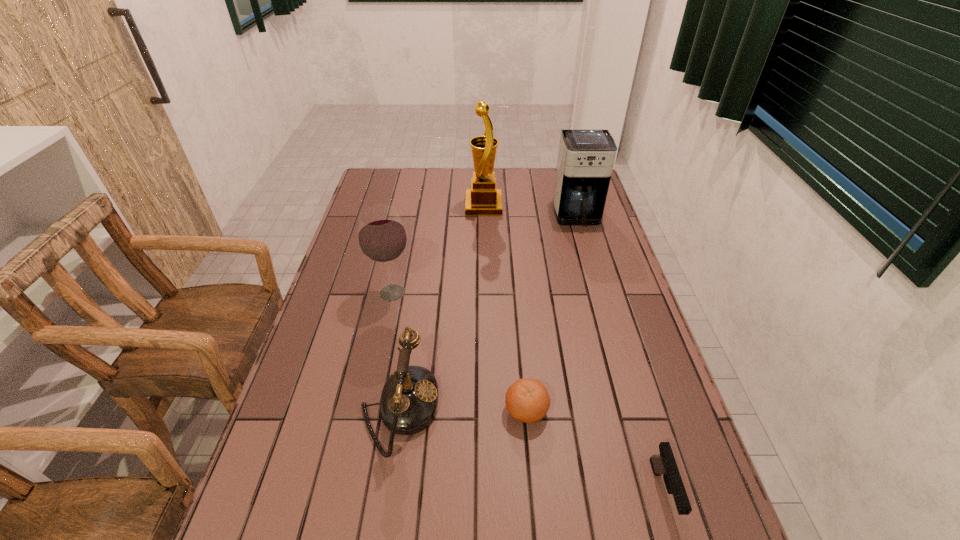
I want to click on vacant space at the far left corner of the desktop, so click(387, 177).

Identify the location of vacant space that's between the pistol and the coffee maker. (620, 354).

Find the location of a particular element. This screenshot has width=960, height=540. free space that is in between the third shortest object and the coffee maker is located at coordinates (489, 313).

You are a GUI agent. You are given a task and a screenshot of the screen. Output one action in this format:
    pyautogui.click(x=<x>, y=<y>)
    Task: Click on the free point between the telephone and the pistol
    The image size is (960, 540).
    Given the screenshot: What is the action you would take?
    pyautogui.click(x=531, y=450)

Find the location of a particular element. This screenshot has width=960, height=540. free space between the clementine and the fourth tallest object is located at coordinates coord(463,409).

Identify the location of free spot between the clementine and the alcohol. (460, 351).

Where is `vacant space in between the third shortest object and the tallest object`? Image resolution: width=960 pixels, height=540 pixels. vacant space in between the third shortest object and the tallest object is located at coordinates (442, 307).

Image resolution: width=960 pixels, height=540 pixels. I want to click on free area in between the fourth tallest object and the award, so click(x=442, y=307).

Identify the location of unoccupied position between the third farthest object and the third shortest object. The image size is (960, 540). (396, 351).

The image size is (960, 540). Find the location of `object that is the fourth closest to the tallest object`. object that is the fourth closest to the tallest object is located at coordinates (527, 400).